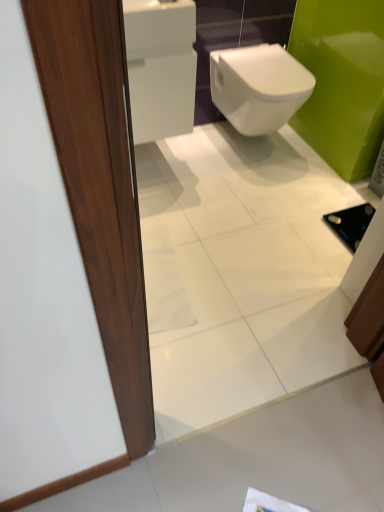
Question: Is white paper at lower center spatially inside matte wood door at left, or outside of it?

Choices:
 (A) inside
 (B) outside

Answer: (B)

Question: Looking at their shapes, would you say white paper at lower center is wider or thinner than matte wood door at left?

Choices:
 (A) wide
 (B) thin

Answer: (A)

Question: Estimate the real-world distances between objects in this image. Which object is closer to the white paper at lower center?

Choices:
 (A) matte wood door at left
 (B) white glossy tile at lower left
 (C) white glossy bidet at center

Answer: (B)

Question: Based on their relative distances, which object is nearer to the white glossy tile at lower left?

Choices:
 (A) white glossy bidet at center
 (B) matte wood door at left
 (C) white paper at lower center

Answer: (C)